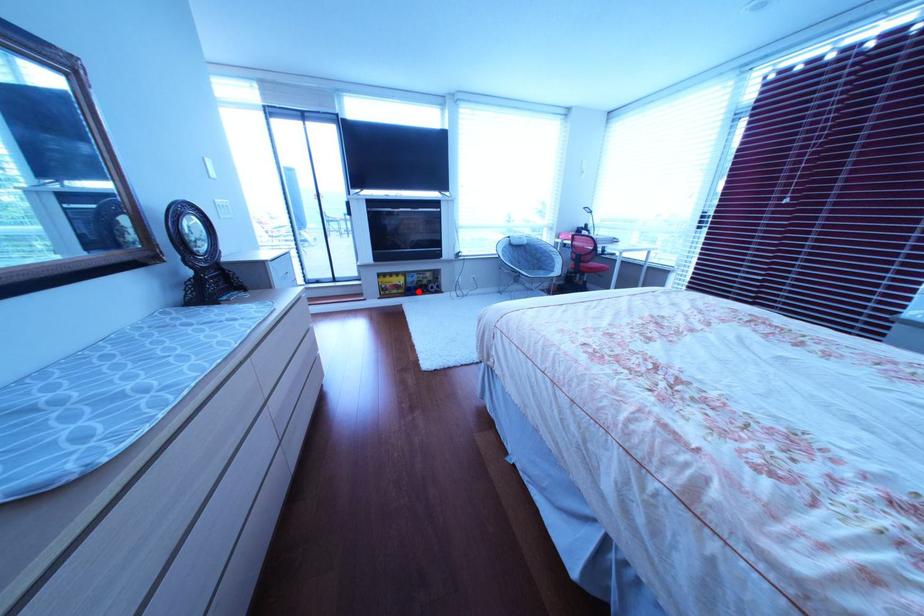
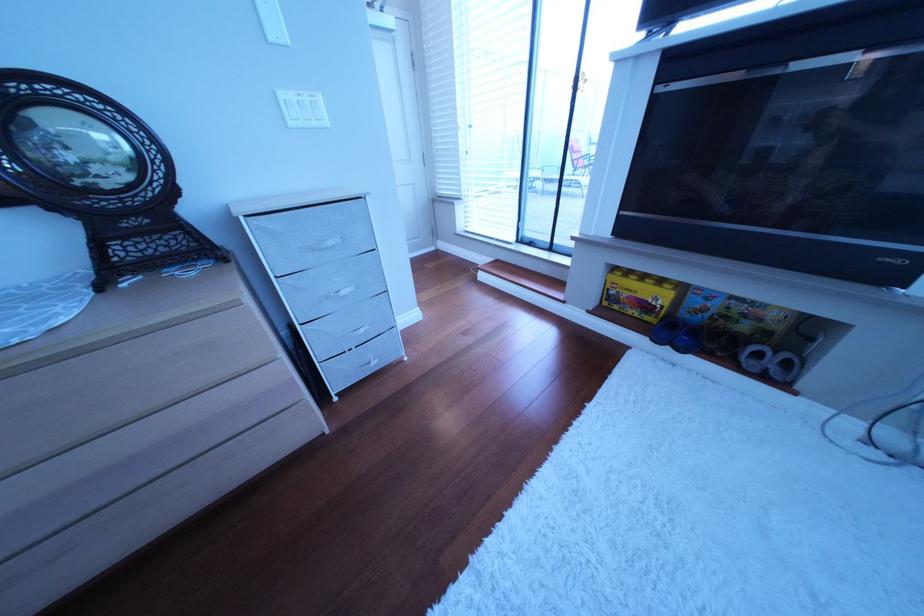
Locate, in the second image, the point that corresponds to the highlighted location in the first image.

(672, 320)